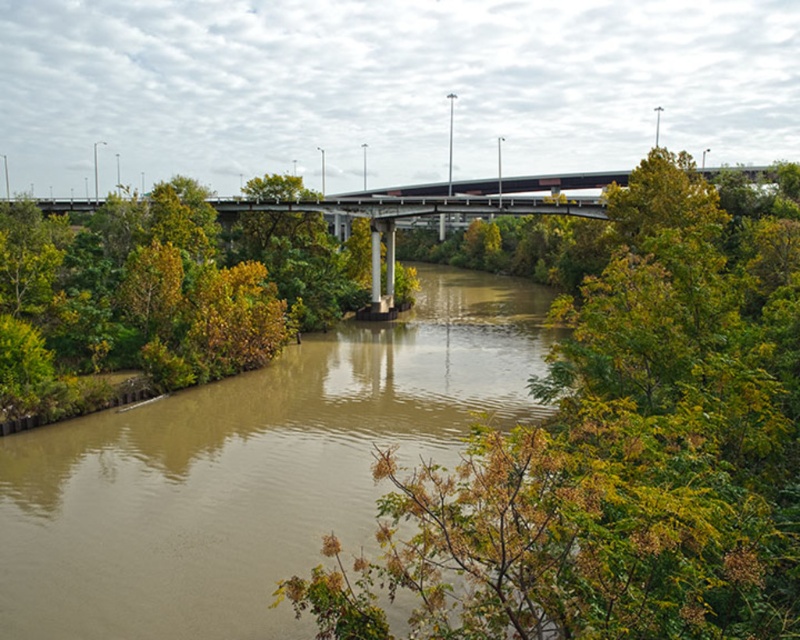
Question: Which object is closer to the camera taking this photo?

Choices:
 (A) brown muddy water at center
 (B) green leafy tree at center

Answer: (B)

Question: Which of the following is the farthest from the observer?

Choices:
 (A) (424, 400)
 (B) (482, 616)

Answer: (A)

Question: Does green leafy tree at center appear on the right side of brown muddy water at center?

Choices:
 (A) no
 (B) yes

Answer: (B)

Question: Does green leafy tree at center have a smaller size compared to brown muddy water at center?

Choices:
 (A) no
 (B) yes

Answer: (A)

Question: Is green leafy tree at center below brown muddy water at center?

Choices:
 (A) yes
 (B) no

Answer: (B)